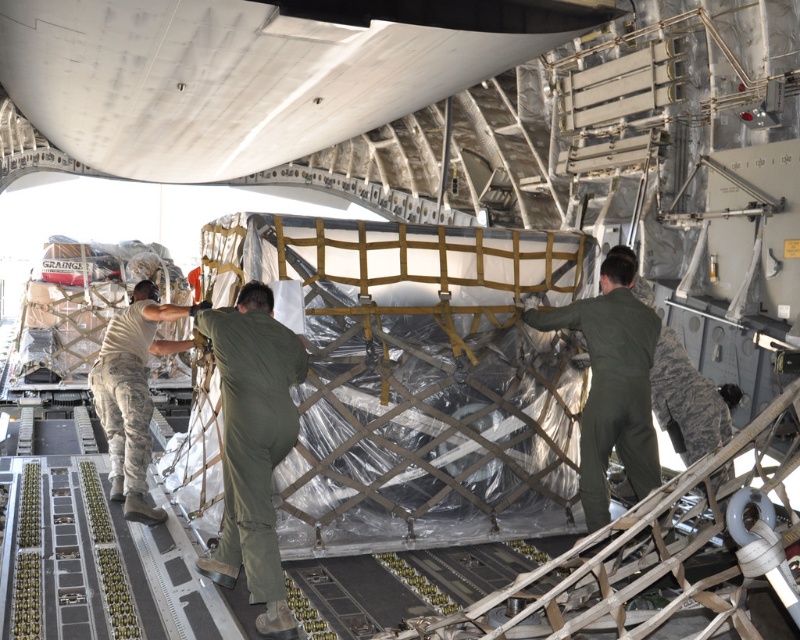
Can you confirm if green matte jumpsuit at center is positioned to the left of camouflage uniform at left?

No, green matte jumpsuit at center is not to the left of camouflage uniform at left.

How far apart are green matte jumpsuit at center and camouflage uniform at left?

They are 13.03 feet apart.

Between point (638, 413) and point (104, 378), which one is positioned behind?

The point (104, 378) is behind.

Identify the location of green matte jumpsuit at center. (612, 385).

Is point (266, 593) closer to viewer compared to point (656, 320)?

Yes, point (266, 593) is closer to viewer.

Is point (216, 328) farther from camera compared to point (596, 433)?

No, it is in front of (596, 433).

Locate an element on the screen. The width and height of the screenshot is (800, 640). green uniform at center is located at coordinates (254, 444).

Can you confirm if green uniform at center is positioned above camouflage uniform at left?

Actually, green uniform at center is below camouflage uniform at left.

Is the position of green uniform at center more distant than that of camouflage uniform at left?

No, it is in front of camouflage uniform at left.

Locate an element on the screen. green uniform at center is located at coordinates (254, 444).